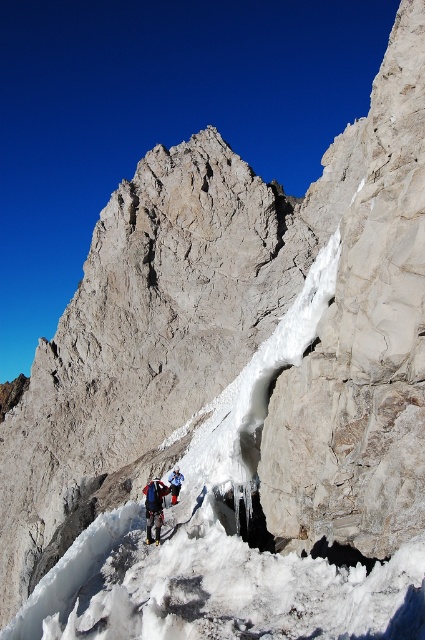
Question: Which object appears closest to the camera in this image?

Choices:
 (A) blue fabric jacket at lower center
 (B) matte blue jacket at center

Answer: (B)

Question: Observing the image, what is the correct spatial positioning of matte blue jacket at center in reference to blue fabric jacket at lower center?

Choices:
 (A) left
 (B) right

Answer: (A)

Question: Is matte blue jacket at center to the right of blue fabric jacket at lower center from the viewer's perspective?

Choices:
 (A) yes
 (B) no

Answer: (B)

Question: Is matte blue jacket at center to the left of blue fabric jacket at lower center from the viewer's perspective?

Choices:
 (A) yes
 (B) no

Answer: (A)

Question: Which of the following is the farthest from the observer?

Choices:
 (A) (170, 488)
 (B) (150, 525)

Answer: (A)